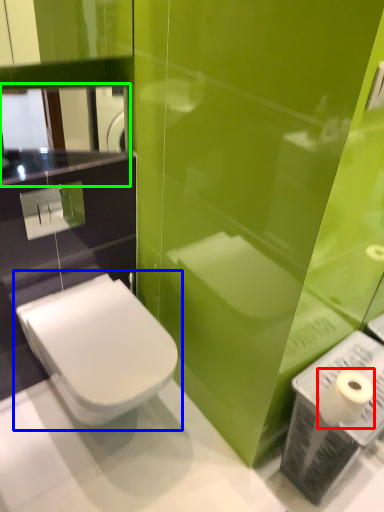
Question: Based on their relative distances, which object is farther from toilet paper (highlighted by a red box)? Choose from toilet (highlighted by a blue box) and mirror (highlighted by a green box).

Choices:
 (A) toilet
 (B) mirror

Answer: (B)